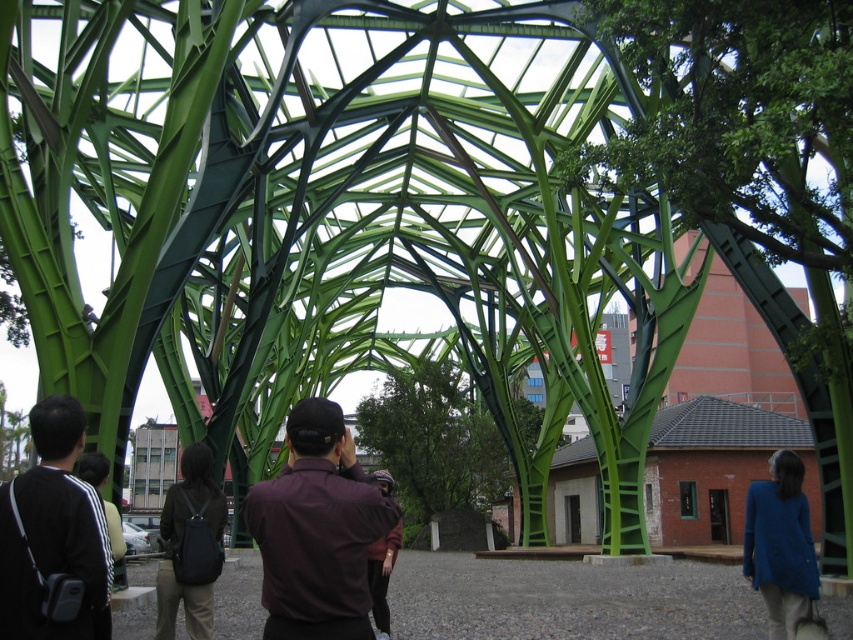
Question: Is maroon fabric shirt at center positioned behind dark gray fabric jacket at lower left?

Choices:
 (A) yes
 (B) no

Answer: (A)

Question: Is maroon fabric shirt at center to the left of dark gray fabric jacket at lower left from the viewer's perspective?

Choices:
 (A) yes
 (B) no

Answer: (B)

Question: Does maroon fabric shirt at center have a lesser width compared to dark gray fabric jacket at lower left?

Choices:
 (A) yes
 (B) no

Answer: (B)

Question: Which of the following is the closest to the observer?

Choices:
 (A) maroon fabric shirt at center
 (B) dark gray fabric jacket at lower left

Answer: (B)